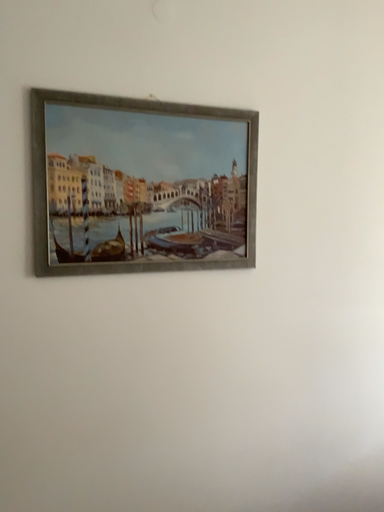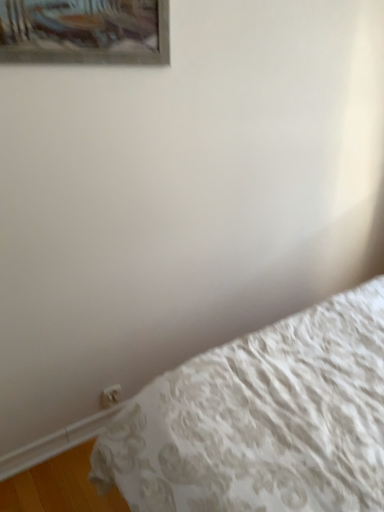
Question: How did the camera likely rotate when shooting the video?

Choices:
 (A) rotated upward
 (B) rotated downward

Answer: (B)